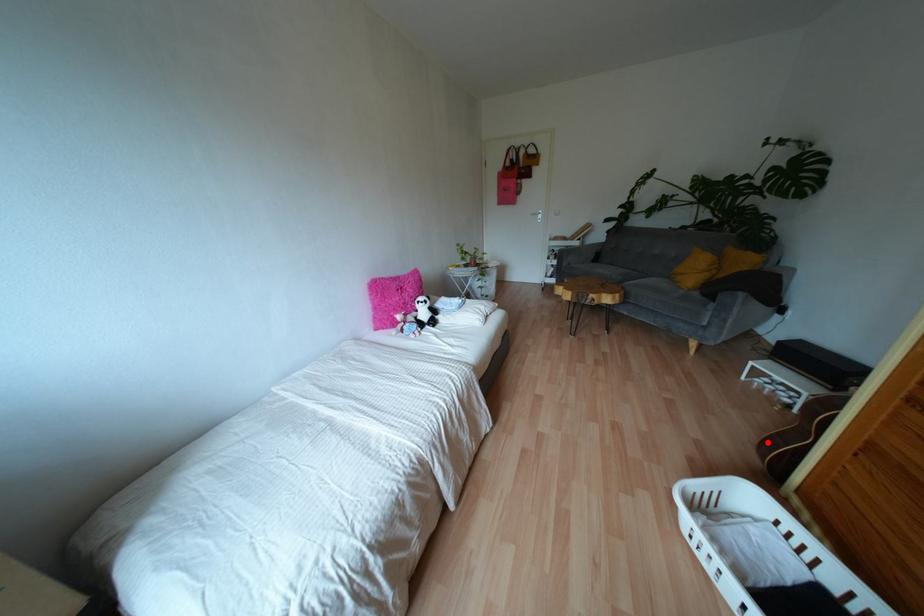
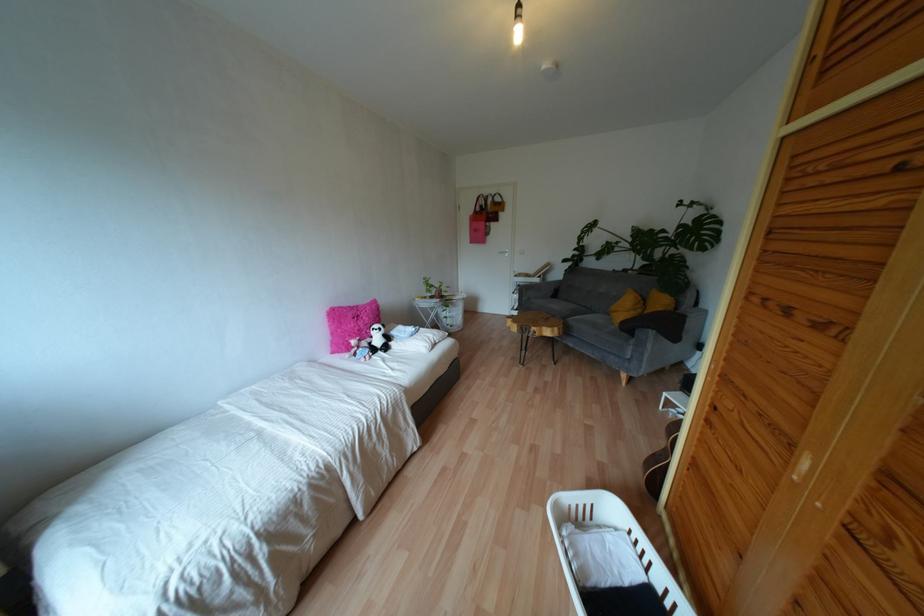
Question: A red point is marked in image1. In image2, is the corresponding 3D point closer to the camera or farther? Reply with the corresponding letter.

Choices:
 (A) The corresponding 3D point is closer.
 (B) The corresponding 3D point is farther.

Answer: (A)